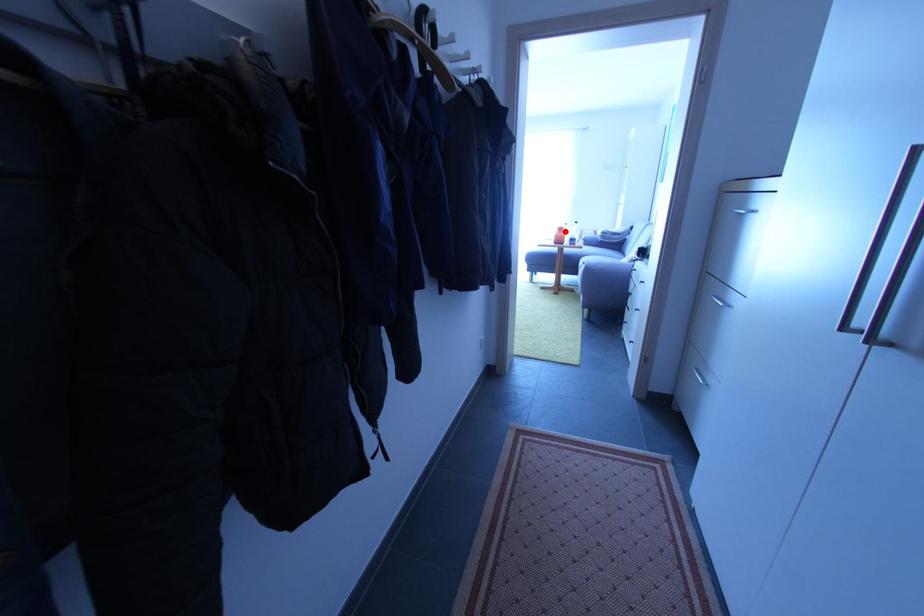
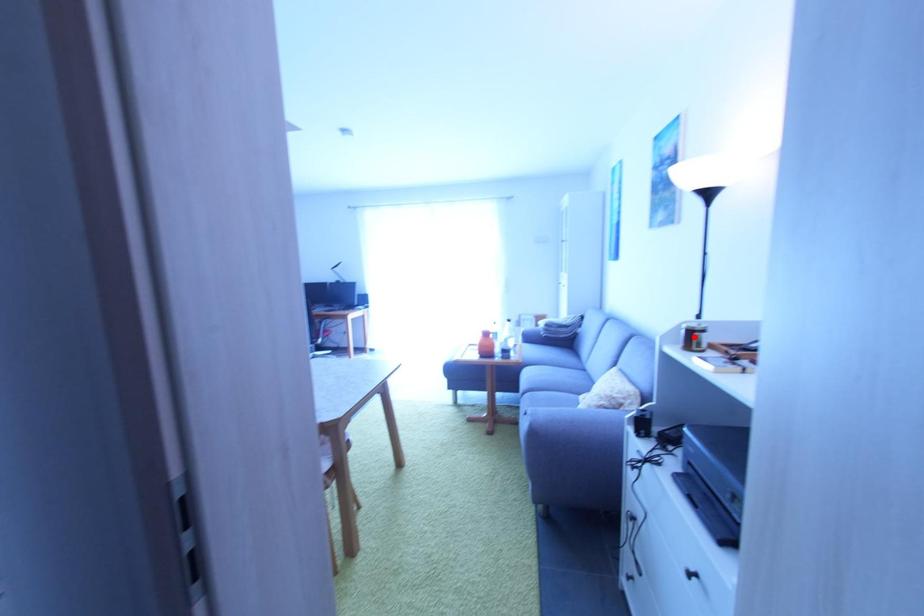
In the scene shown: I am providing you with two images of the same scene from different viewpoints. A red point is marked on the first image and another point is marked on the second image. Are the points marked in image1 and image2 representing the same 3D position?

No